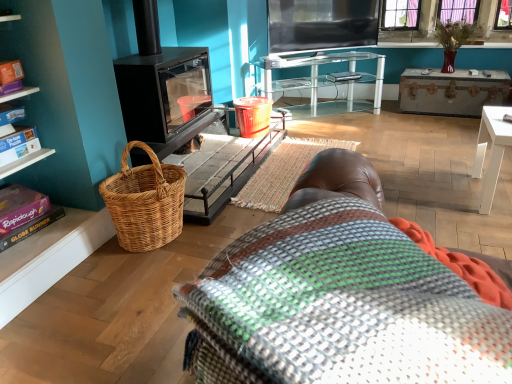
Find the location of a particular element. free area below white glossy table at lower right, arranged as the first table when viewed from the right (from a real-world perspective) is located at coordinates (494, 198).